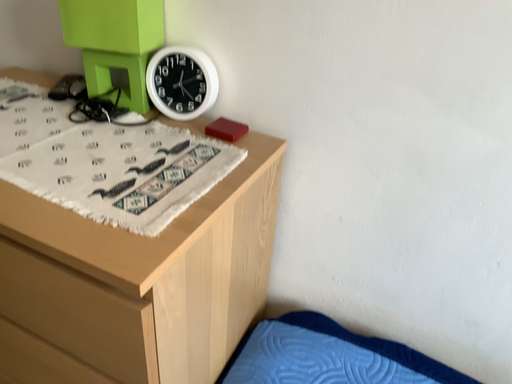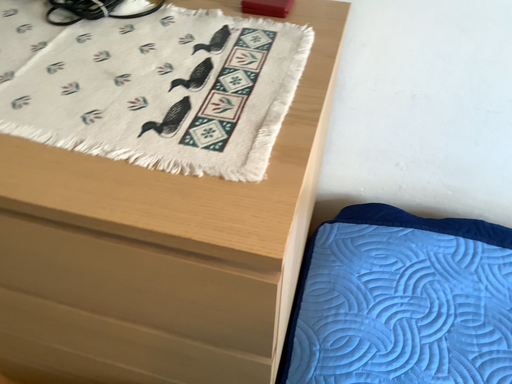
Question: How did the camera likely rotate when shooting the video?

Choices:
 (A) rotated right
 (B) rotated left

Answer: (A)